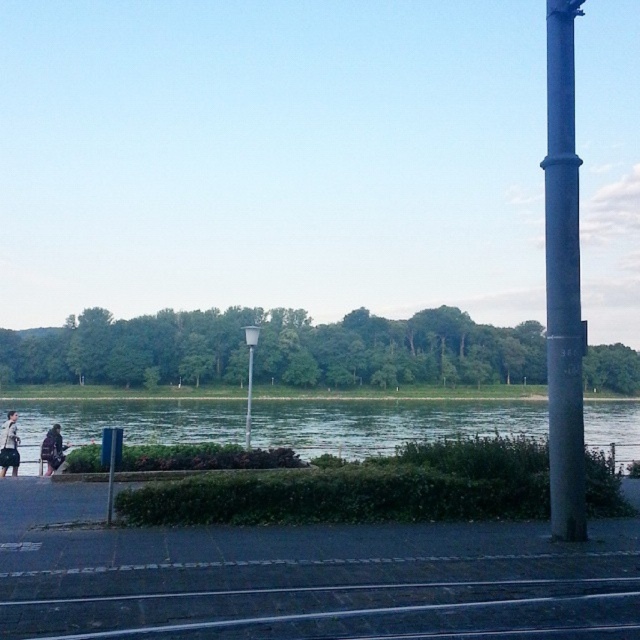
Question: Which point is farther to the camera?

Choices:
 (A) (563, 256)
 (B) (349, 456)

Answer: (B)

Question: Is smooth gray pole at right closer to camera compared to white glossy pole at center?

Choices:
 (A) yes
 (B) no

Answer: (A)

Question: Does dark brown leather jacket at lower left appear over metallic gray streetlight at center?

Choices:
 (A) yes
 (B) no

Answer: (A)

Question: Does dark brown leather jacket at lower left have a lesser width compared to metallic gray streetlight at center?

Choices:
 (A) no
 (B) yes

Answer: (B)

Question: Which object appears farthest from the camera in this image?

Choices:
 (A) white glossy pole at center
 (B) metallic gray streetlight at center
 (C) green grass at lower center

Answer: (B)

Question: Which point is farther to the camera?

Choices:
 (A) white glossy pole at center
 (B) green grass at lower center
 (C) smooth gray pole at right
 (D) dark brown leather jacket at lower left

Answer: (A)